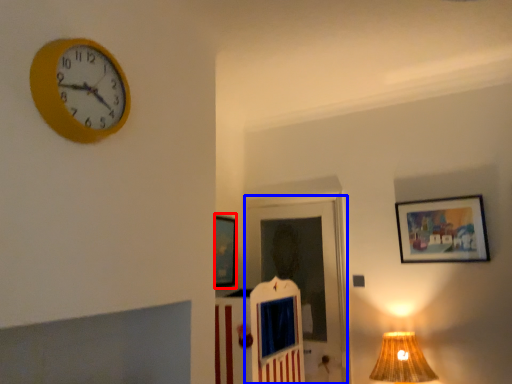
Question: Among these objects, which one is farthest to the camera, picture frame (highlighted by a red box) or door (highlighted by a blue box)?

Choices:
 (A) picture frame
 (B) door

Answer: (A)